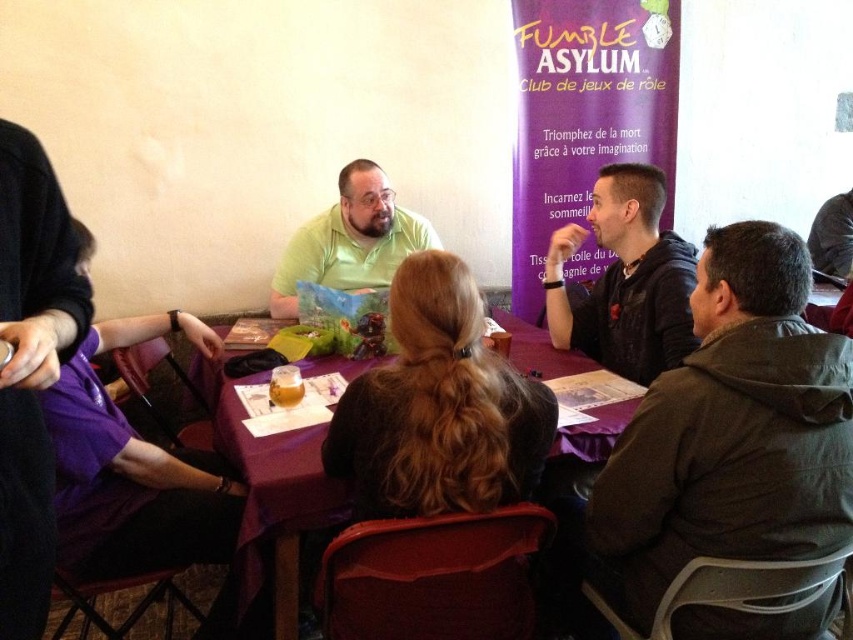
You are standing at the center of the image and want to hand a snack to the person wearing the dark gray hoodie at lower right. In which general direction should you move to reach their location?

The dark gray hoodie at lower right is located at point 0.677 on the x axis and 0.857 on the y axis. Since you are at the center, you should move towards the lower right direction to reach their location.

You are organizing a roleplaying game session and want to ensure there is enough space between the dark gray hoodie at lower right and the black leather jacket at center for participants to move comfortably. Based on their widths, which clothing item requires more space on the table?

The dark gray hoodie at lower right requires more space on the table since its width surpasses that of the black leather jacket at center.